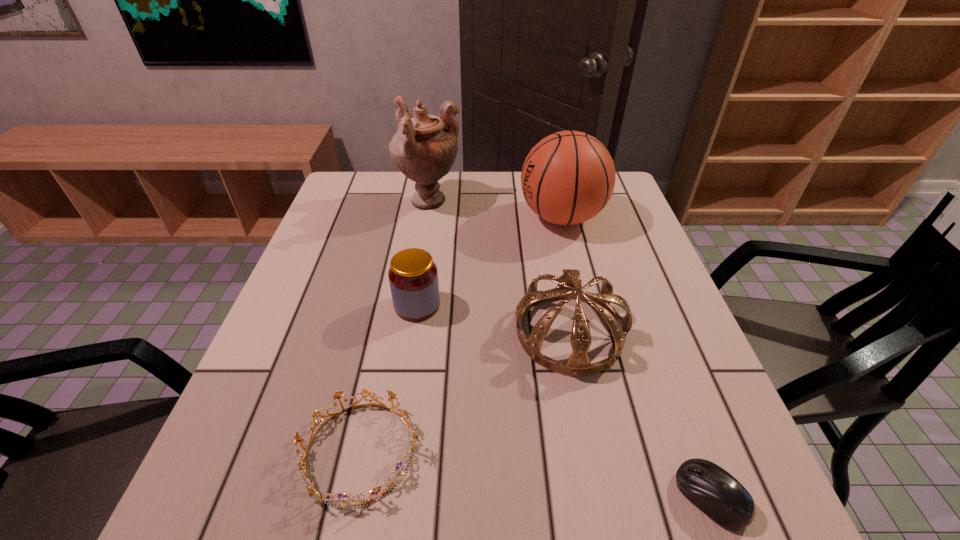
Locate an element on the screen. The width and height of the screenshot is (960, 540). the tallest object is located at coordinates (424, 148).

The height and width of the screenshot is (540, 960). In order to click on basketball in this screenshot , I will do `click(567, 178)`.

The width and height of the screenshot is (960, 540). In order to click on the third tallest object in this screenshot , I will do `click(569, 286)`.

You are a GUI agent. You are given a task and a screenshot of the screen. Output one action in this format:
    pyautogui.click(x=<x>, y=<y>)
    Task: Click on the taller tiara
    
    Given the screenshot: What is the action you would take?
    pyautogui.click(x=569, y=286)

The width and height of the screenshot is (960, 540). Identify the location of jar. coord(413,277).

In order to click on the shorter tiara in this screenshot , I will do [x=413, y=435].

The width and height of the screenshot is (960, 540). Identify the location of the nearer tiara. (413, 435).

At what (x,y) coordinates should I click in order to perform the action: click on the shortest object. Please return your answer as a coordinate pair (x, y). The width and height of the screenshot is (960, 540). Looking at the image, I should click on (713, 490).

Image resolution: width=960 pixels, height=540 pixels. I want to click on vacant space positioned 0.380m on the right of the urn, so click(591, 201).

Where is `free spot located on the surface of the second tallest object near the brand logo`? free spot located on the surface of the second tallest object near the brand logo is located at coordinates (500, 217).